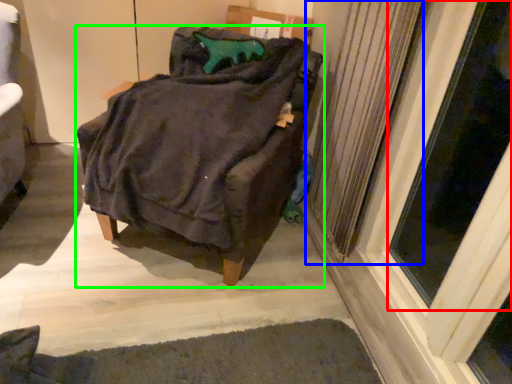
Question: Which object is the closest to the screen door (highlighted by a red box)? Choose among these: radiator (highlighted by a blue box) or furniture (highlighted by a green box).

Choices:
 (A) radiator
 (B) furniture

Answer: (A)